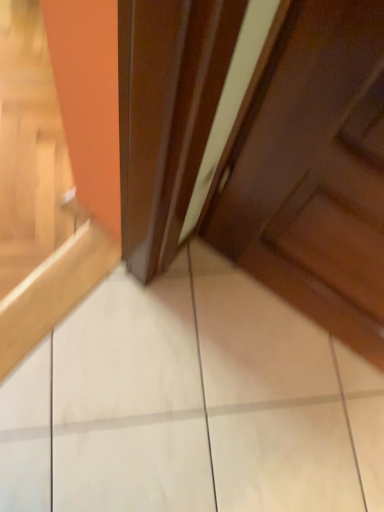
The width and height of the screenshot is (384, 512). Describe the element at coordinates (312, 170) in the screenshot. I see `glossy wood door at center` at that location.

Locate an element on the screen. glossy wood door at center is located at coordinates coord(312,170).

Where is `glossy wood door at center`? glossy wood door at center is located at coordinates (312, 170).